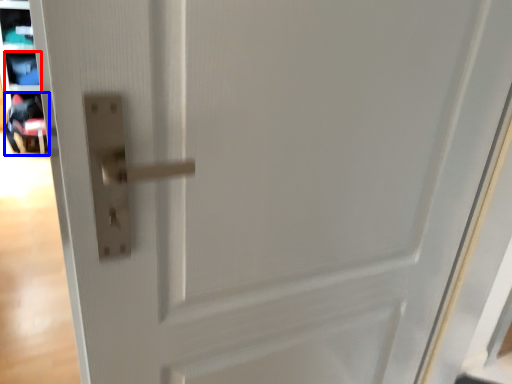
Question: Which of the following is the farthest to the observer, shelf (highlighted by a red box) or baby carriage (highlighted by a blue box)?

Choices:
 (A) shelf
 (B) baby carriage

Answer: (A)